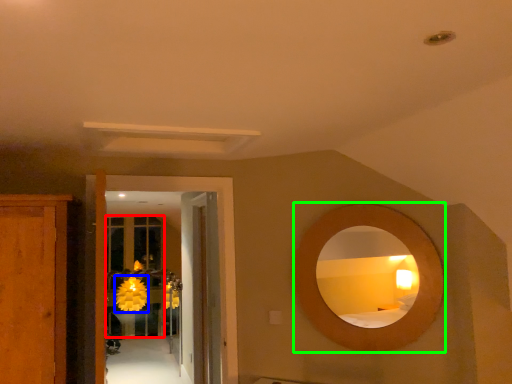
Question: Which object is the closest to the glass door (highlighted by a red box)? Choose among these: flower (highlighted by a blue box) or mirror (highlighted by a green box).

Choices:
 (A) flower
 (B) mirror

Answer: (A)